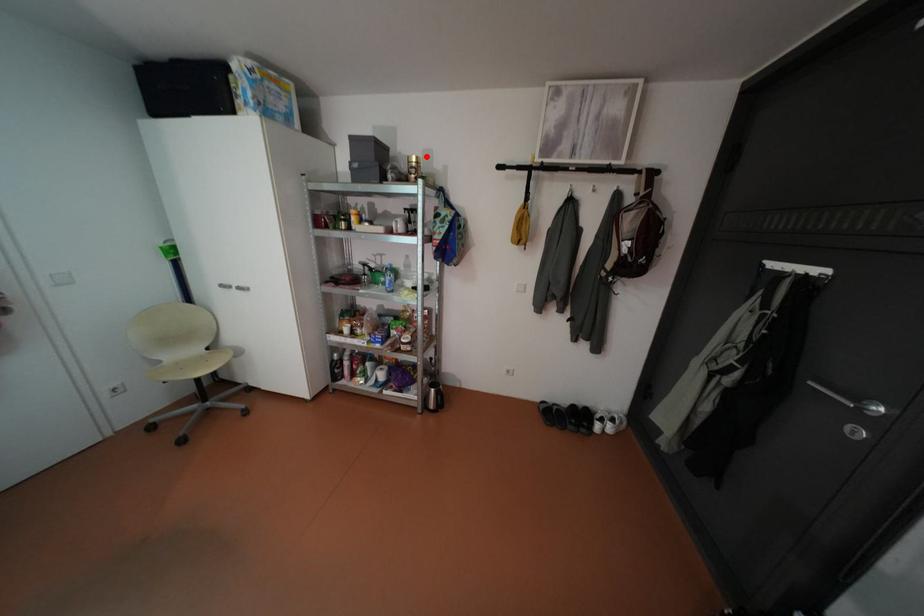
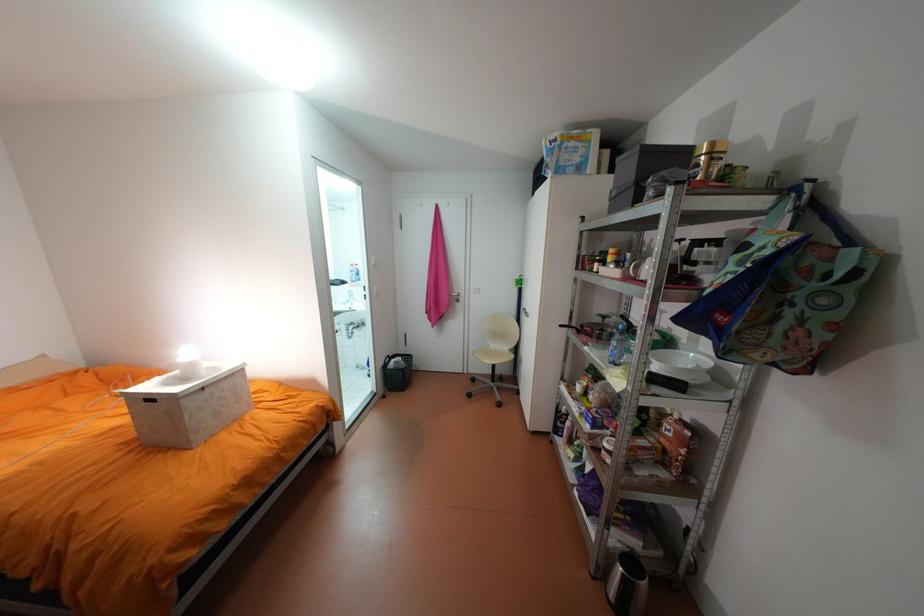
The point at the highlighted location is marked in the first image. Where is the corresponding point in the second image?

(722, 143)